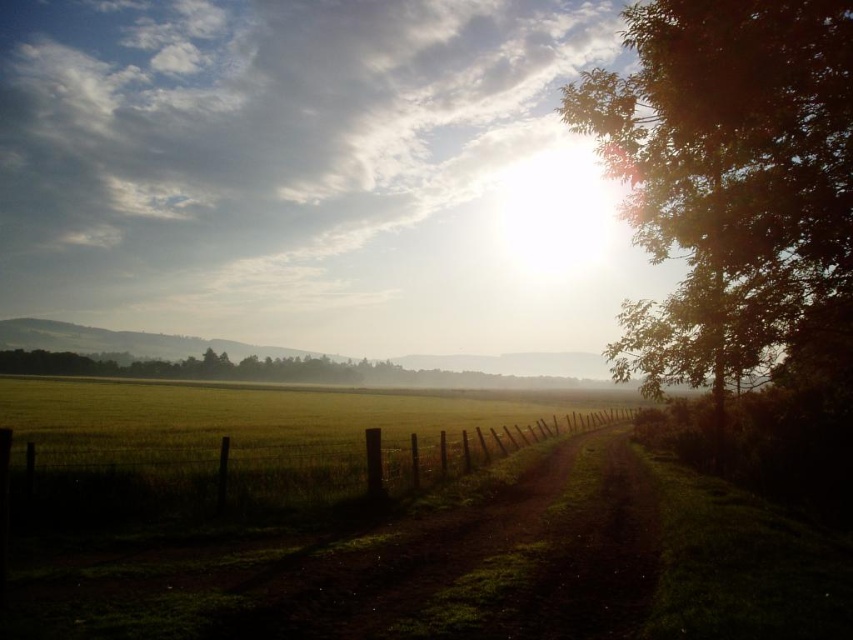
Question: Is green leafy tree at right in front of wooden fence at center?

Choices:
 (A) no
 (B) yes

Answer: (B)

Question: Does dull brown dirt track at center appear under green wooden fence at lower left?

Choices:
 (A) yes
 (B) no

Answer: (B)

Question: Which of the following is the closest to the observer?

Choices:
 (A) wooden fence at center
 (B) green leafy tree at right
 (C) green wooden fence at lower left
 (D) dull brown dirt track at center

Answer: (D)

Question: Does green wooden fence at lower left appear on the left side of wooden fence at center?

Choices:
 (A) yes
 (B) no

Answer: (A)

Question: Which point is farther from the camera taking this photo?

Choices:
 (A) (567, 536)
 (B) (395, 488)
 (C) (780, 228)
 (D) (299, 484)

Answer: (B)

Question: Which object is positioned closest to the green wooden fence at lower left?

Choices:
 (A) green leafy tree at right
 (B) wooden fence at center

Answer: (B)